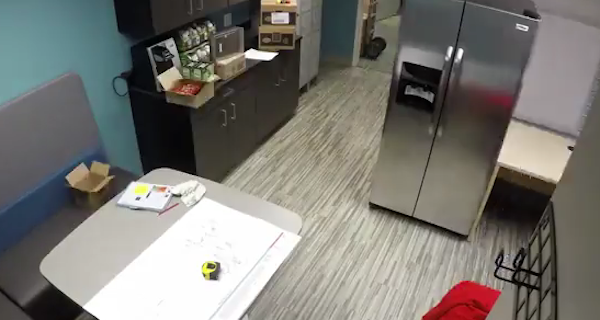
Locate an element on the screen. The height and width of the screenshot is (320, 600). black metal wall rack with hooks is located at coordinates (554, 289).